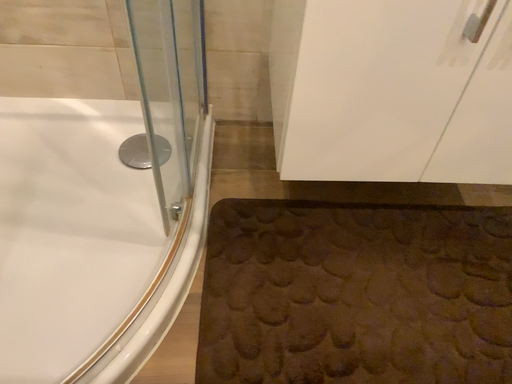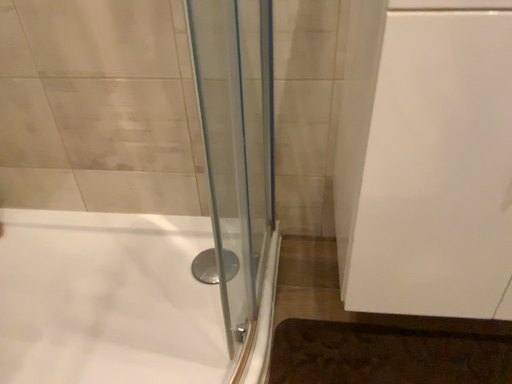
Question: Which way did the camera rotate in the video?

Choices:
 (A) rotated upward
 (B) rotated downward

Answer: (A)